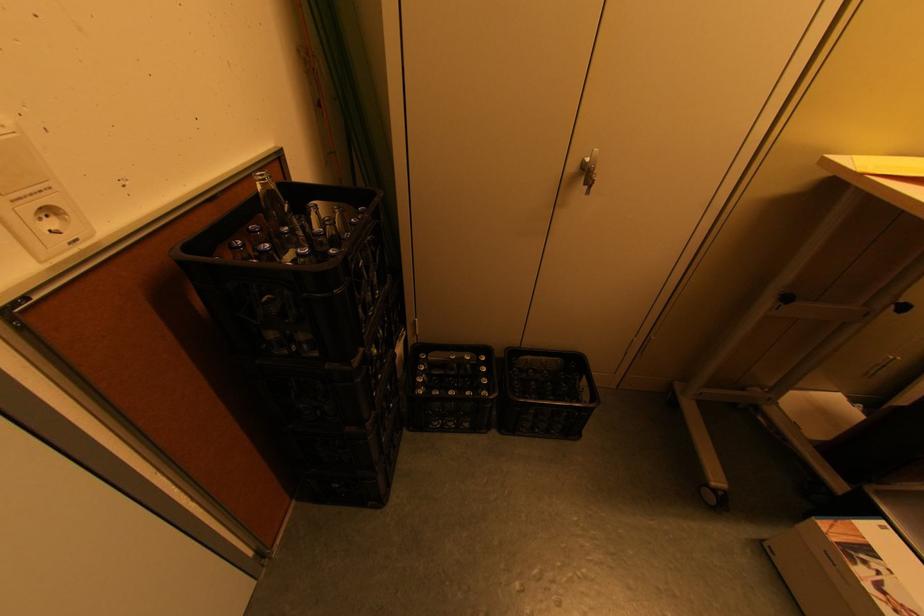
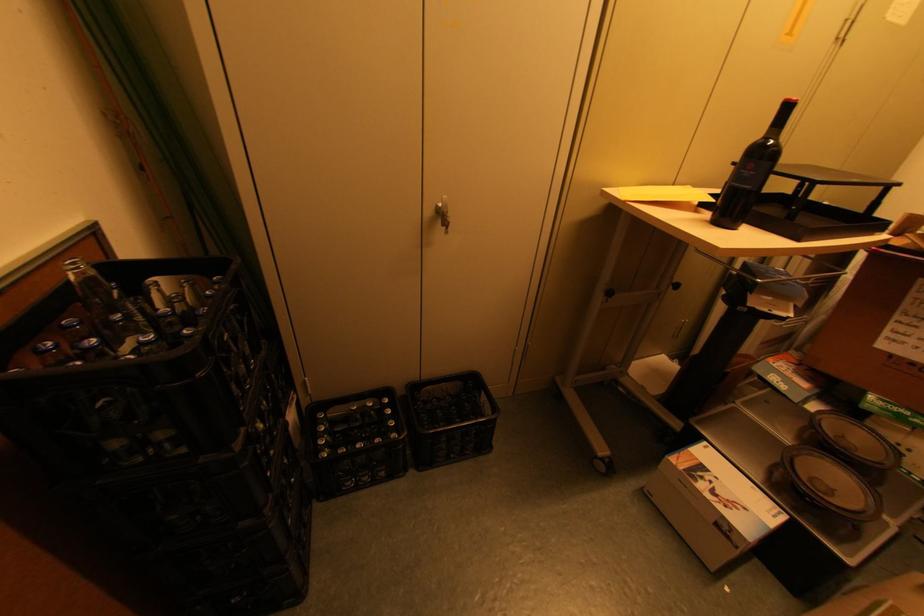
Consider the image. What movement of the cameraman would produce the second image?

The movement direction of the cameraman is right, backward.